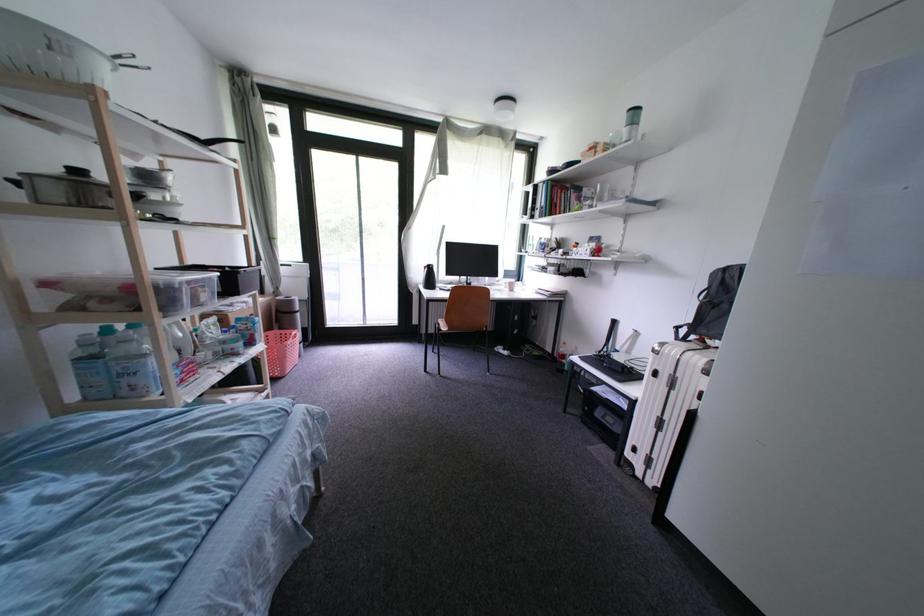
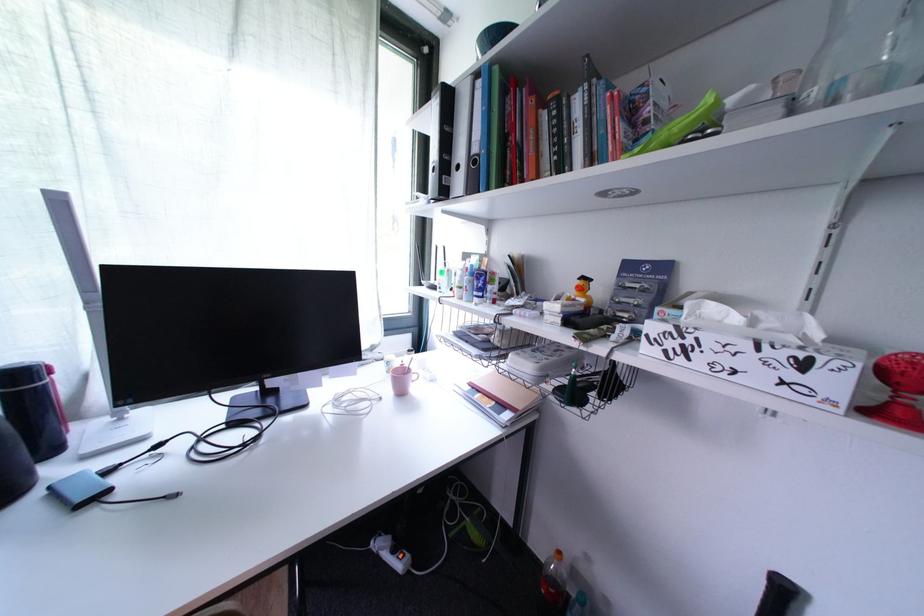
Locate, in the second image, the point that corresponds to (x=512, y=352) in the first image.

(402, 553)